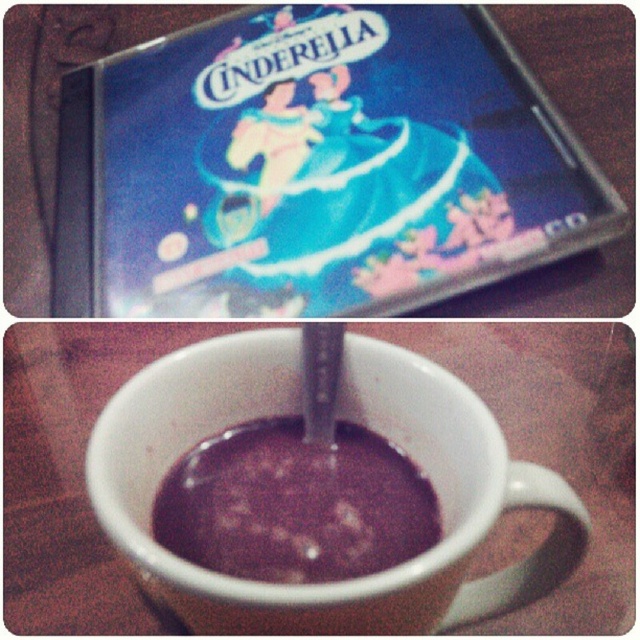
Looking at this image, which is more to the left, white ceramic mug at center or dark glossy chocolate at center?

dark glossy chocolate at center is more to the left.

Is white ceramic mug at center smaller than dark glossy chocolate at center?

No, white ceramic mug at center is not smaller than dark glossy chocolate at center.

Describe the element at coordinates (342, 419) in the screenshot. I see `white ceramic mug at center` at that location.

The height and width of the screenshot is (640, 640). In order to click on white ceramic mug at center in this screenshot , I will do `click(342, 419)`.